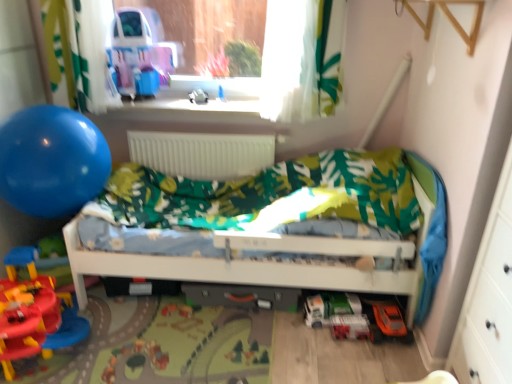
Locate an element on the screen. free spot below shiny plastic toy car at upper left (from a real-world perspective) is located at coordinates (146, 99).